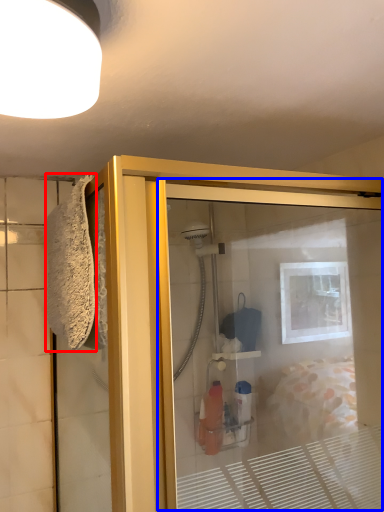
Question: Which of the following is the closest to the observer, bath towel (highlighted by a red box) or screen door (highlighted by a blue box)?

Choices:
 (A) bath towel
 (B) screen door

Answer: (B)